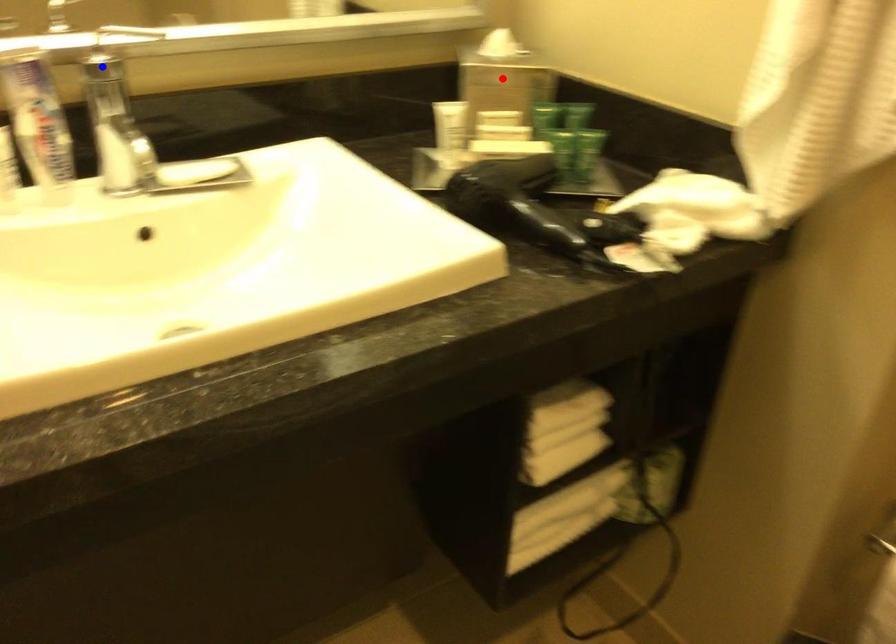
Question: Two points are marked on the image. Which point is closer to the camera?

Choices:
 (A) Blue point is closer.
 (B) Red point is closer.

Answer: (A)